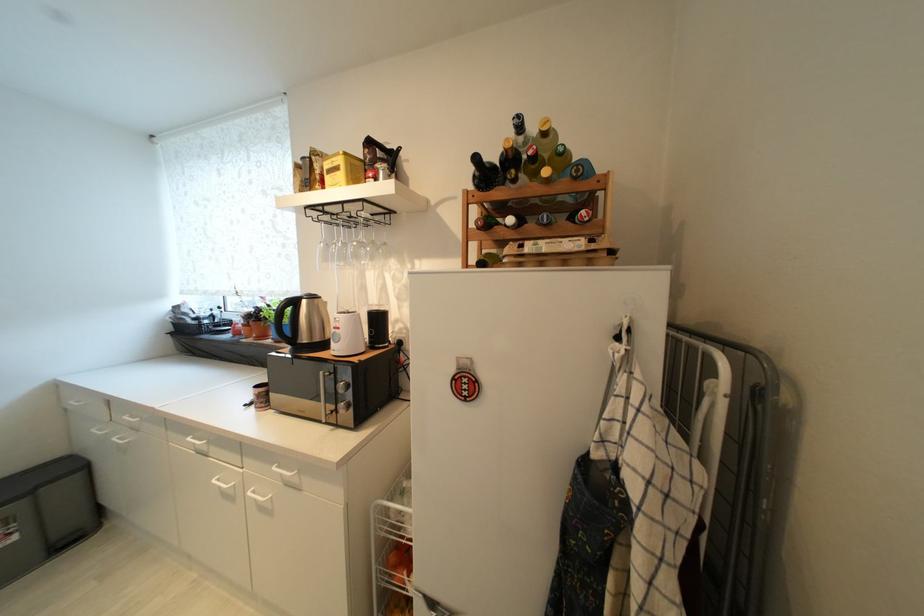
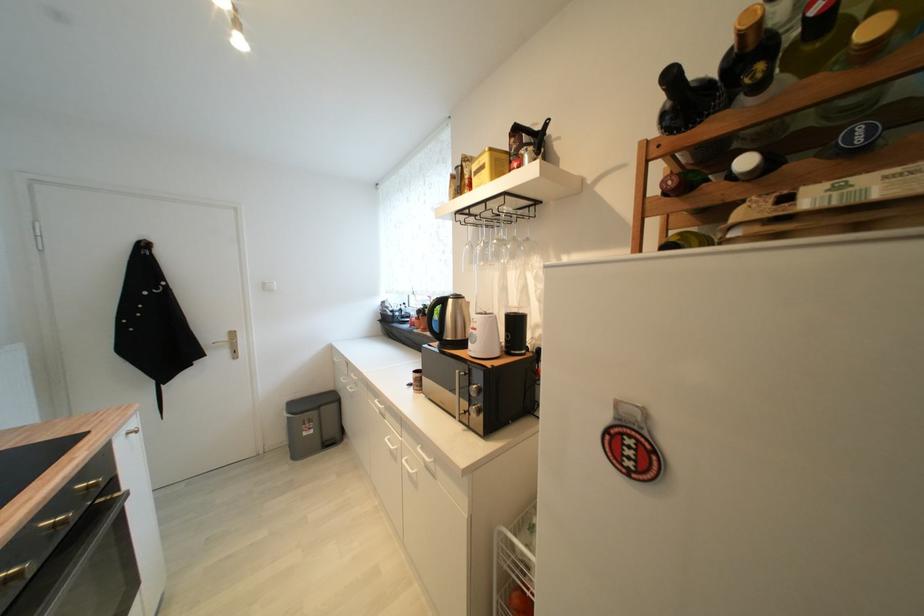
Question: The camera is either moving clockwise (left) or counter-clockwise (right) around the object. The first image is from the beginning of the video and the second image is from the end. Is the camera moving left or right when shooting the video?

Choices:
 (A) Left
 (B) Right

Answer: (B)